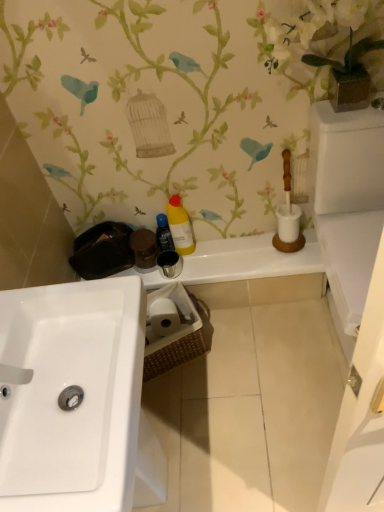
The width and height of the screenshot is (384, 512). I want to click on vacant region in front of yellow matte bottle at center, arranged as the 1th cleaning product when viewed from the left, so click(190, 269).